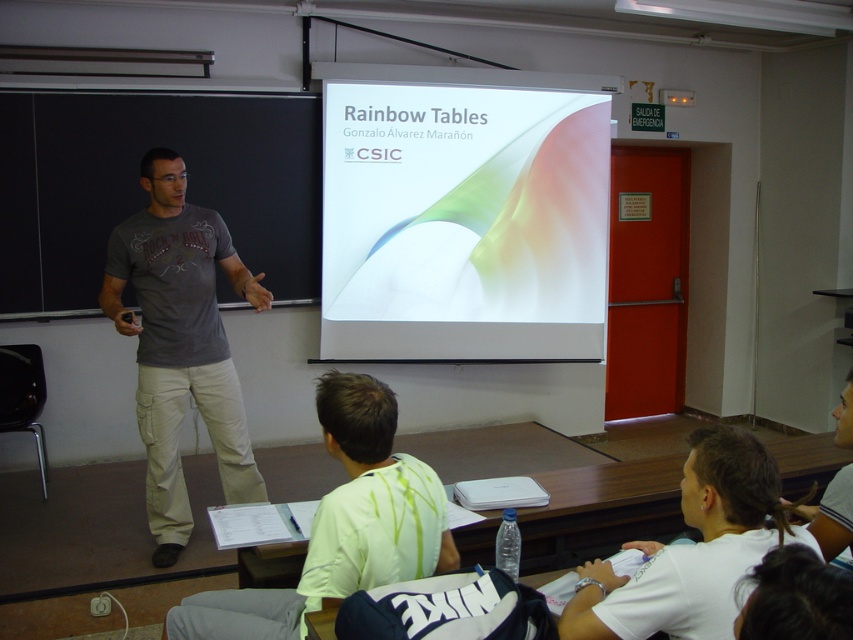
You are a student sitting in the classroom during the presentation. You need to write down a note but realize you don not have a pen. You see the blackboard at left and the white cotton shirt at lower right. Which object is bigger and can you use it to hold a pen?

The blackboard at left has a larger size compared to the white cotton shirt at lower right. However, the blackboard is an object on the wall and cannot be used to hold a pen. The white cotton shirt at lower right is clothing and likely belongs to someone else, so you shouldn not take a pen from there without permission.

You are a photographer in the classroom and want to capture a clear photo of the light green fabric shirt at lower center without the white cotton shirt at lower right blocking it. How should you adjust your camera angle?

To avoid the white cotton shirt at lower right blocking the light green fabric shirt at lower center, you should position your camera angle above the white cotton shirt at lower right so that the light green fabric shirt at lower center becomes visible underneath.

You are an attendee sitting in the front row of the classroom. You notice two points marked on the projection screen during the presentation. Which point is closer to you, point (173, 369) or point (589, 561)?

Point (173, 369) is closer to you because it is further to the viewer than point (589, 561).